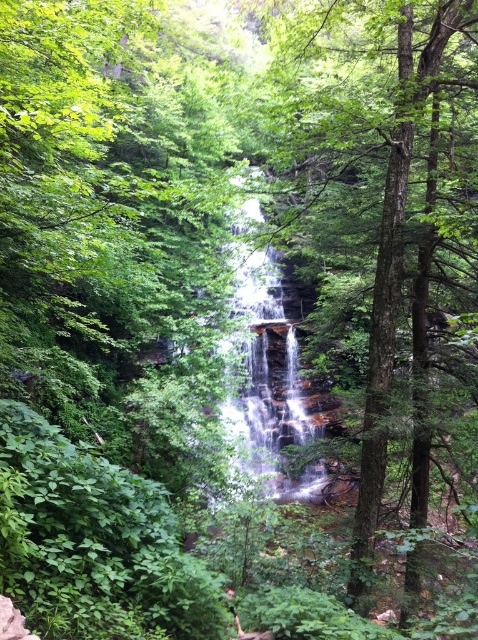
Question: In this image, where is green rough bark tree at center located relative to translucent glass waterfall at center?

Choices:
 (A) right
 (B) left

Answer: (A)

Question: Is green rough bark tree at center smaller than translucent glass waterfall at center?

Choices:
 (A) yes
 (B) no

Answer: (B)

Question: Observing the image, what is the correct spatial positioning of green rough bark tree at center in reference to translucent glass waterfall at center?

Choices:
 (A) right
 (B) left

Answer: (A)